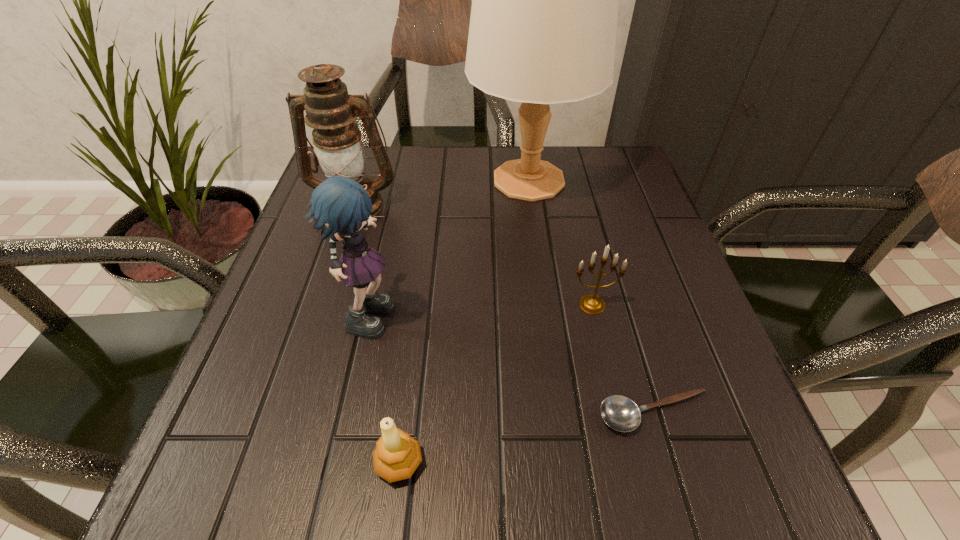
Find the location of a particular element. This screenshot has height=540, width=960. table lamp located at the right edge is located at coordinates tap(543, 23).

Where is `candelabrum present at the right edge`? Image resolution: width=960 pixels, height=540 pixels. candelabrum present at the right edge is located at coordinates (591, 303).

Where is `ladle that is at the right edge`? This screenshot has width=960, height=540. ladle that is at the right edge is located at coordinates (620, 413).

Where is `object that is at the far left corner`? Image resolution: width=960 pixels, height=540 pixels. object that is at the far left corner is located at coordinates (331, 112).

This screenshot has width=960, height=540. Find the location of `object situated at the far right corner`. object situated at the far right corner is located at coordinates (x=543, y=23).

Find the location of a particular element. vacant region at the far edge of the desktop is located at coordinates (547, 146).

Where is `vacant point at the near edge`? vacant point at the near edge is located at coordinates (320, 461).

The width and height of the screenshot is (960, 540). Identify the location of free space at the left edge. pyautogui.click(x=283, y=293).

The image size is (960, 540). What are the coordinates of `vacant area at the right edge` in the screenshot? It's located at (668, 255).

You are a GUI agent. You are given a task and a screenshot of the screen. Output one action in this format:
    pyautogui.click(x=<x>, y=<y>)
    Task: Click on the free space at the far right corner
    Image resolution: width=960 pixels, height=540 pixels.
    Given the screenshot: What is the action you would take?
    pyautogui.click(x=595, y=189)